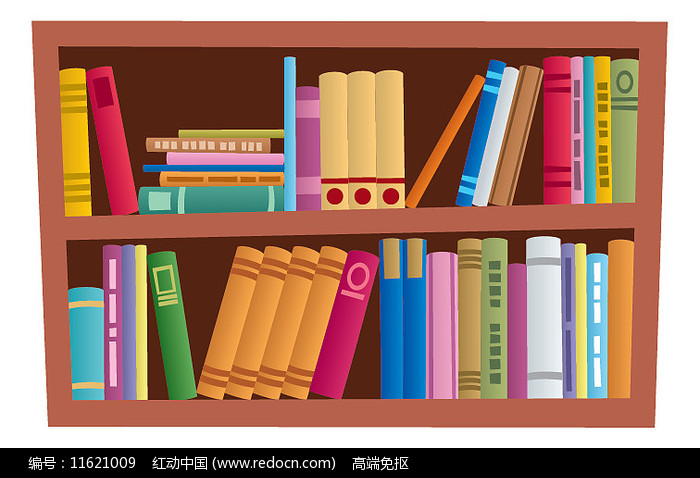
You are a GUI agent. You are given a task and a screenshot of the screen. Output one action in this format:
    pyautogui.click(x=<x>, y=<y>)
    Task: Click on the pink books
    The image size is (700, 478).
    Given the screenshot: What is the action you would take?
    pyautogui.click(x=116, y=139), pyautogui.click(x=346, y=310), pyautogui.click(x=566, y=126), pyautogui.click(x=255, y=158)